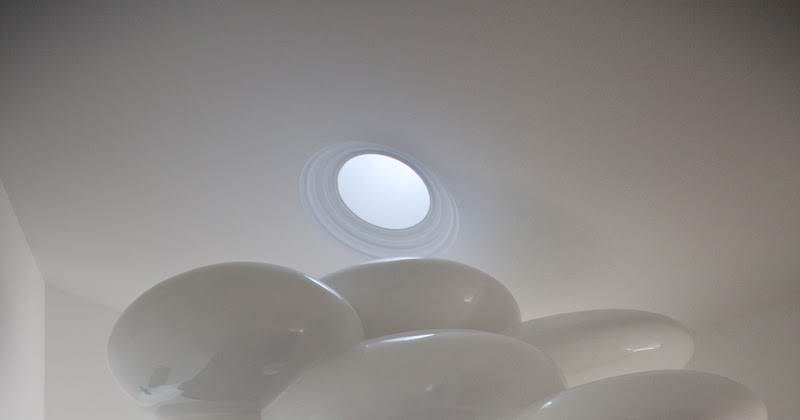
The height and width of the screenshot is (420, 800). I want to click on corner, so click(x=48, y=284).